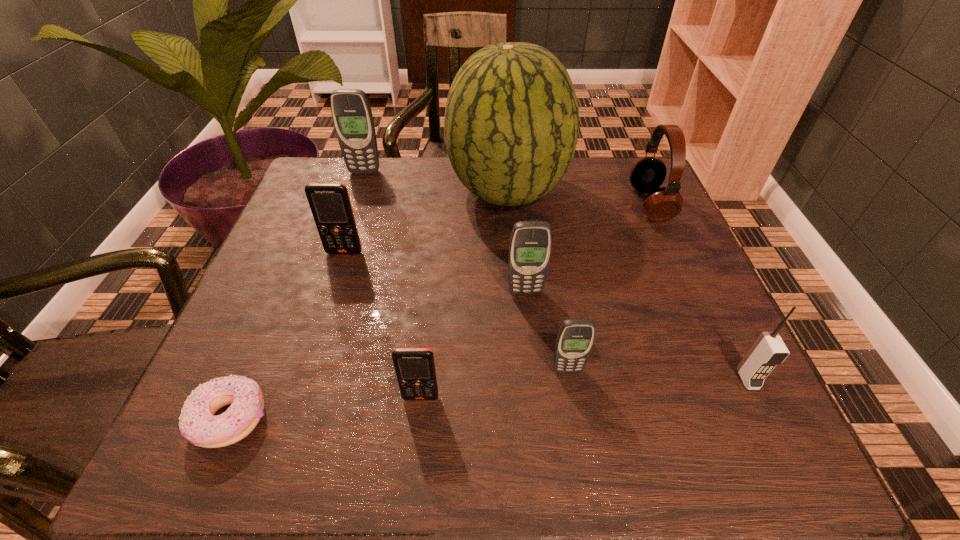
I want to click on free space located 0.130m on the screen of the fifth nearest object, so click(531, 350).

The image size is (960, 540). I want to click on free space located on the screen of the fourth farthest object, so 324,316.

You are a GUI agent. You are given a task and a screenshot of the screen. Output one action in this format:
    pyautogui.click(x=<x>, y=<y>)
    Task: Click on the vacant space located on the front-facing side of the rightmost cellular telephone
    
    Given the screenshot: What is the action you would take?
    pyautogui.click(x=770, y=424)

The width and height of the screenshot is (960, 540). Find the location of `free location located 0.060m on the screen of the third cellular telephone from left to right`. free location located 0.060m on the screen of the third cellular telephone from left to right is located at coordinates (417, 437).

Find the location of a particular element. The height and width of the screenshot is (540, 960). vacant area located on the screen of the nearest gray cellular telephone is located at coordinates (576, 423).

At what (x,y) coordinates should I click in order to perform the action: click on vacant space situated on the back of the doughnut. Please return your answer as a coordinate pair (x, y). Looking at the image, I should click on (268, 330).

Where is `watermelon at the far edge`? Image resolution: width=960 pixels, height=540 pixels. watermelon at the far edge is located at coordinates (511, 124).

Find the location of `cellular telephone present at the far edge`. cellular telephone present at the far edge is located at coordinates (351, 112).

Locate an element on the screen. This screenshot has width=960, height=540. headset located at the far edge is located at coordinates (647, 174).

You are a GUI agent. You are given a task and a screenshot of the screen. Output one action in this format:
    pyautogui.click(x=<x>, y=<y>)
    Task: Click on the object present at the near edge
    This screenshot has height=540, width=960.
    Given the screenshot: What is the action you would take?
    pyautogui.click(x=198, y=425)